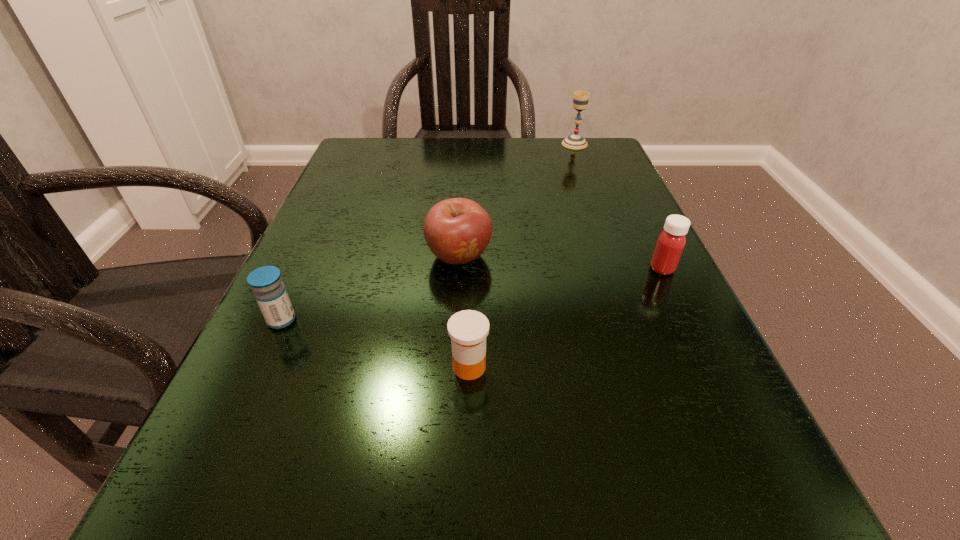
Locate an element on the screen. free space located on the back of the rightmost medicine is located at coordinates (609, 159).

The height and width of the screenshot is (540, 960). I want to click on vacant position located on the side of the apple with the unique marking, so click(454, 347).

The height and width of the screenshot is (540, 960). What are the coordinates of `free space located on the back of the second nearest medicine` in the screenshot? It's located at (346, 181).

I want to click on free space located 0.090m on the label of the second medicine from right to left, so tap(556, 367).

This screenshot has height=540, width=960. Identify the location of object present at the far edge. (580, 100).

Identify the location of object that is positioned at the left edge. click(x=270, y=293).

Where is `chalice present at the right edge`? chalice present at the right edge is located at coordinates (580, 100).

Image resolution: width=960 pixels, height=540 pixels. I want to click on medicine that is positioned at the right edge, so click(x=670, y=244).

Locate an element on the screen. The height and width of the screenshot is (540, 960). object at the far right corner is located at coordinates (x=580, y=100).

In the image, there is a desktop. Identify the location of free space at the far edge. [x=460, y=139].